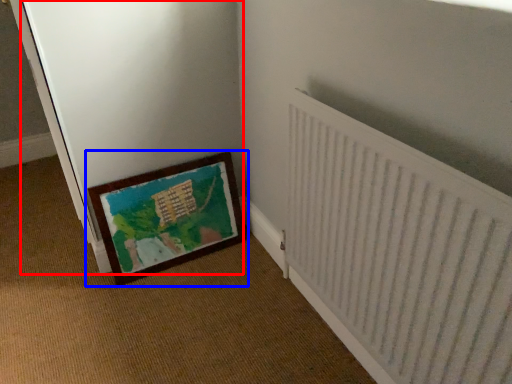
Question: Which object is further to the camera taking this photo, screen door (highlighted by a red box) or picture frame (highlighted by a blue box)?

Choices:
 (A) screen door
 (B) picture frame

Answer: (B)